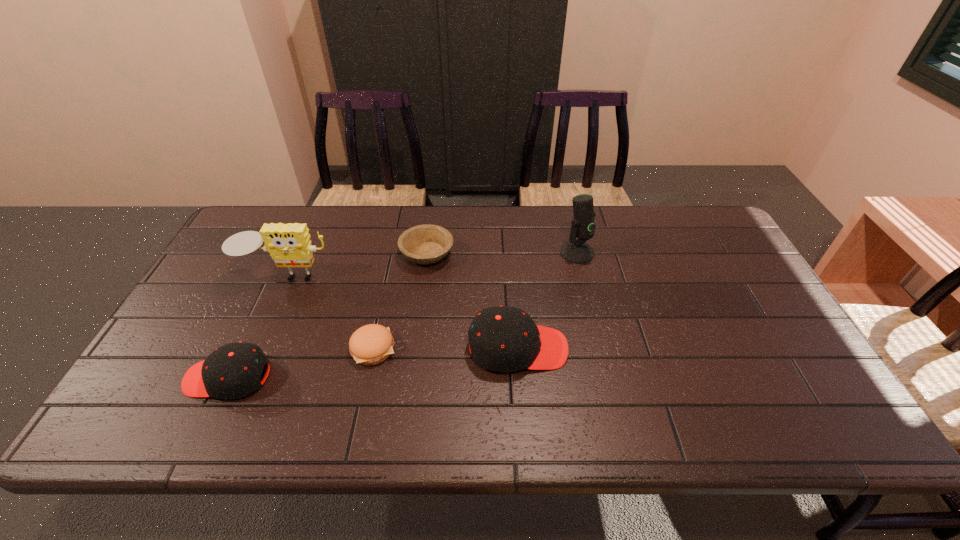
In order to click on free space between the patty and the fourth tallest object in this screenshot , I will do `click(300, 363)`.

Where is `vacant area that lies between the microphone and the bowl`? The image size is (960, 540). vacant area that lies between the microphone and the bowl is located at coordinates (502, 253).

Image resolution: width=960 pixels, height=540 pixels. What are the coordinates of `free area in between the shorter cap and the bowl` in the screenshot? It's located at [327, 316].

Locate an element on the screen. This screenshot has height=540, width=960. free space between the sponge and the bowl is located at coordinates (357, 265).

Find the location of a particular element. Image resolution: width=960 pixels, height=540 pixels. vacant space that's between the fourth shortest object and the patty is located at coordinates (445, 348).

This screenshot has width=960, height=540. I want to click on free area in between the bowl and the microphone, so click(502, 253).

Locate which object is the fourth closest to the left cap. Please provide its 2D coordinates. Your answer should be formatted as a tuple, i.e. [(x, y)], where the tuple contains the x and y coordinates of a point satisfying the conditions above.

[(501, 339)]

Find the location of a particular element. This screenshot has width=960, height=540. object that stands as the fourth closest to the patty is located at coordinates (424, 244).